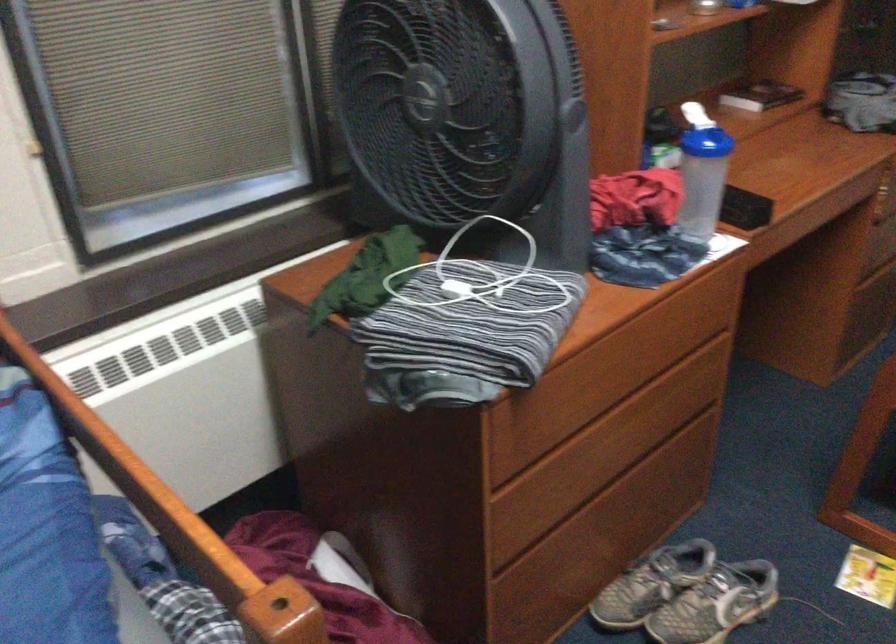
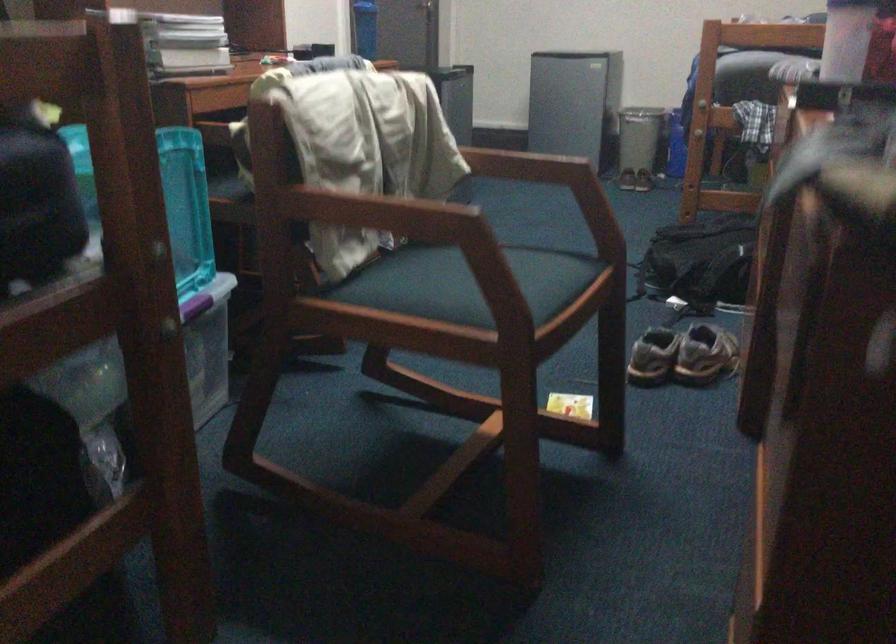
Where in the second image is the point corresponding to point 728,553 from the first image?

(682, 355)